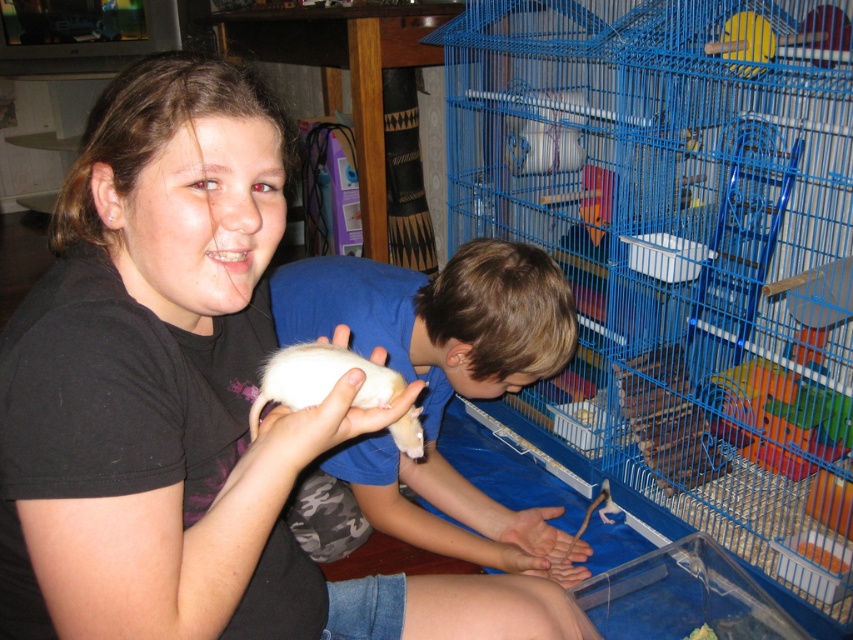
Question: Which object appears closest to the camera in this image?

Choices:
 (A) matte black shirt at upper left
 (B) white fur coat at center
 (C) white soft hamster at center

Answer: (A)

Question: Considering the real-world distances, which object is farthest from the white fur coat at center?

Choices:
 (A) blue wire cage at lower right
 (B) matte black shirt at upper left
 (C) white soft hamster at center

Answer: (A)

Question: Is matte black shirt at upper left wider than white fur coat at center?

Choices:
 (A) no
 (B) yes

Answer: (A)

Question: Is matte black shirt at upper left positioned at the back of white soft hamster at center?

Choices:
 (A) no
 (B) yes

Answer: (A)

Question: Can you confirm if blue wire cage at lower right is smaller than matte black shirt at upper left?

Choices:
 (A) no
 (B) yes

Answer: (A)

Question: Which of the following is the closest to the observer?

Choices:
 (A) (257, 420)
 (B) (412, 360)
 (C) (773, 32)

Answer: (A)